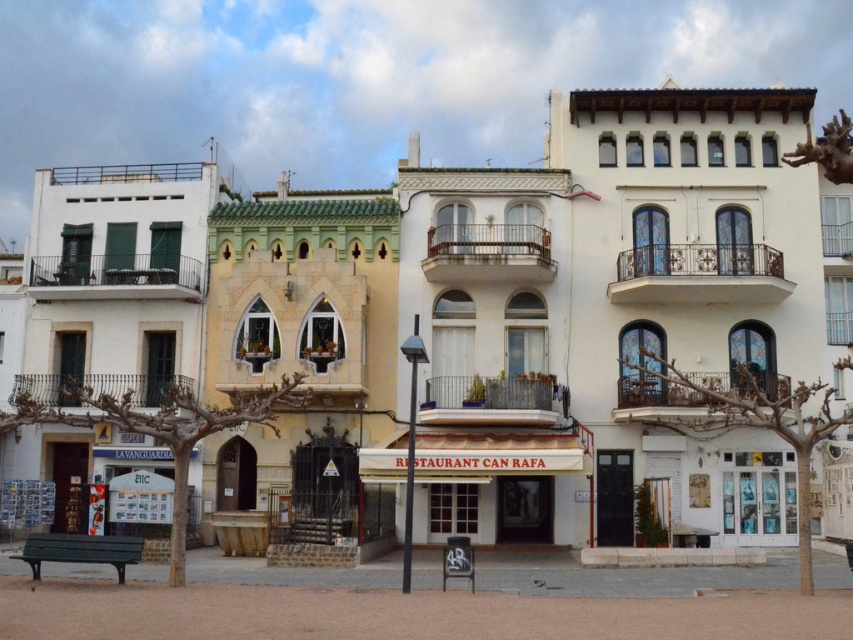
Question: Which object is the farthest from the white textured building at center?

Choices:
 (A) beige textured building at center
 (B) white matte building at left

Answer: (B)

Question: Can you confirm if white matte building at left is bigger than beige textured building at center?

Choices:
 (A) yes
 (B) no

Answer: (A)

Question: Does white matte building at left have a smaller size compared to beige textured building at center?

Choices:
 (A) yes
 (B) no

Answer: (B)

Question: Which is nearer to the white matte building at left?

Choices:
 (A) white textured building at center
 (B) beige textured building at center

Answer: (B)

Question: Which object appears farthest from the camera in this image?

Choices:
 (A) white textured building at center
 (B) white matte building at left
 (C) beige textured building at center

Answer: (A)

Question: Can you confirm if white textured building at center is thinner than beige textured building at center?

Choices:
 (A) no
 (B) yes

Answer: (A)